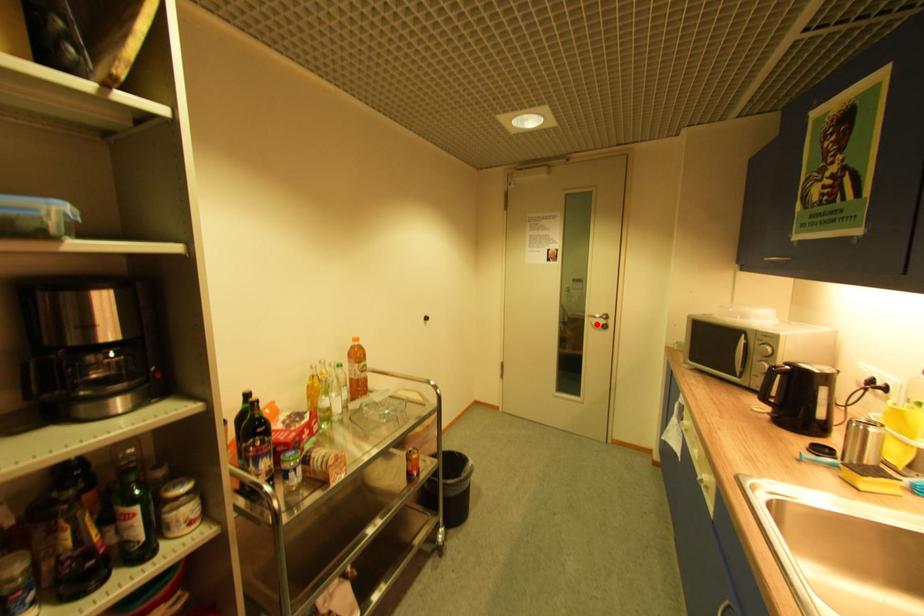
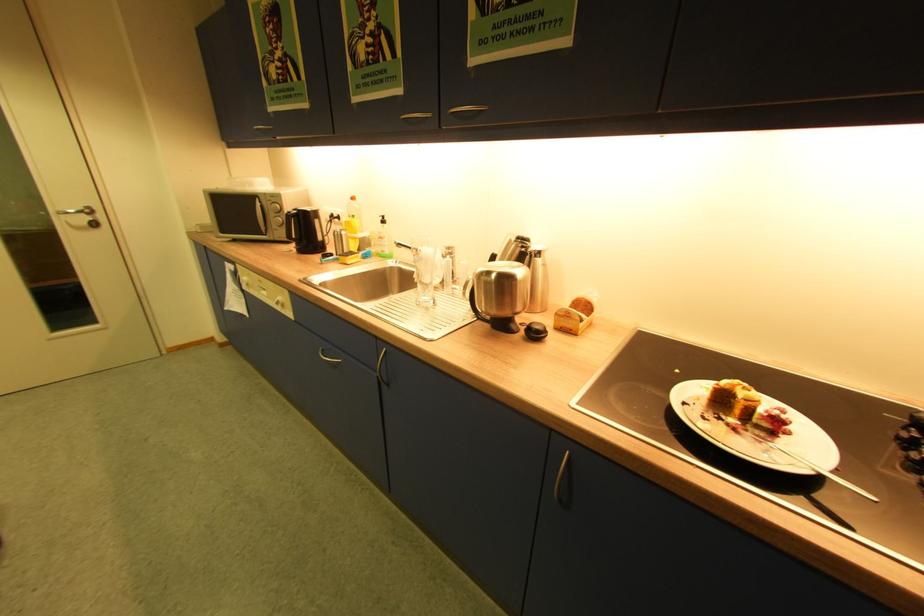
Find the pixel in the second image that matches the highlighted location in the first image.

(74, 224)